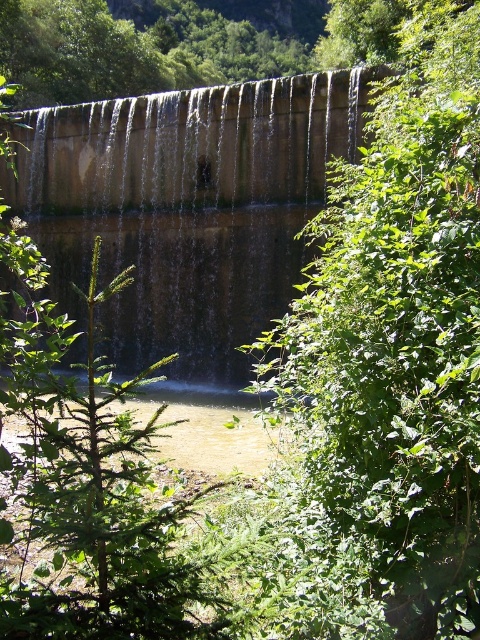
Question: In this image, where is green leafy tree at center located relative to brown concrete dam at center?

Choices:
 (A) left
 (B) right

Answer: (B)

Question: Which point is closer to the camera?

Choices:
 (A) (435, 256)
 (B) (312, 173)

Answer: (A)

Question: Can you confirm if green leafy tree at center is positioned below brown concrete dam at center?

Choices:
 (A) no
 (B) yes

Answer: (B)

Question: Which of the following is the farthest from the observer?

Choices:
 (A) green leafy tree at center
 (B) brown concrete dam at center

Answer: (B)

Question: Which object is closer to the camera taking this photo?

Choices:
 (A) green leafy tree at center
 (B) brown concrete dam at center

Answer: (A)

Question: Does green leafy tree at center appear under brown concrete dam at center?

Choices:
 (A) yes
 (B) no

Answer: (A)